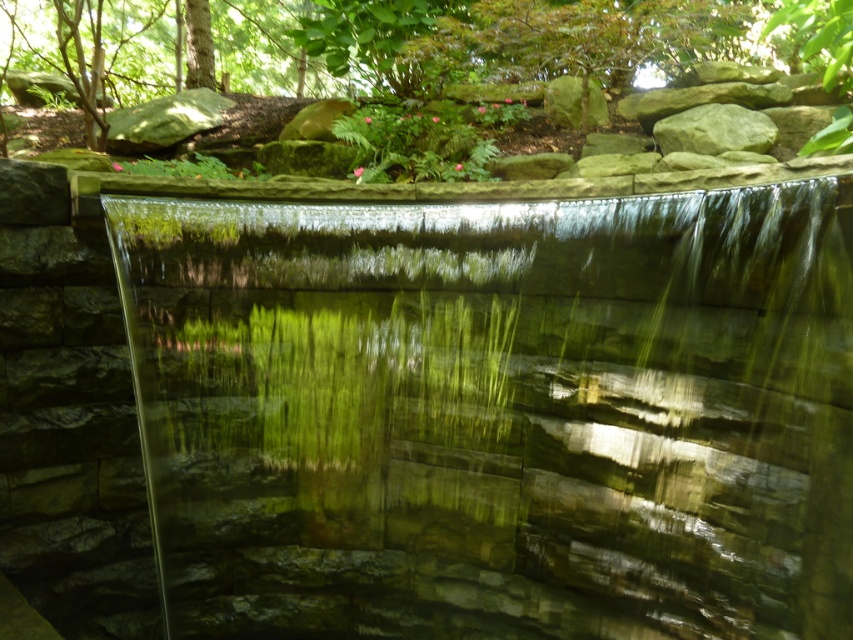
Between transparent glass waterfall at center and green rough stone at upper right, which one is positioned lower?

transparent glass waterfall at center is below.

Can you confirm if transparent glass waterfall at center is positioned below green rough stone at upper right?

Yes, transparent glass waterfall at center is below green rough stone at upper right.

Is point (219, 428) positioned in front of point (672, 148)?

That is True.

The height and width of the screenshot is (640, 853). What are the coordinates of `transparent glass waterfall at center` in the screenshot? It's located at (497, 413).